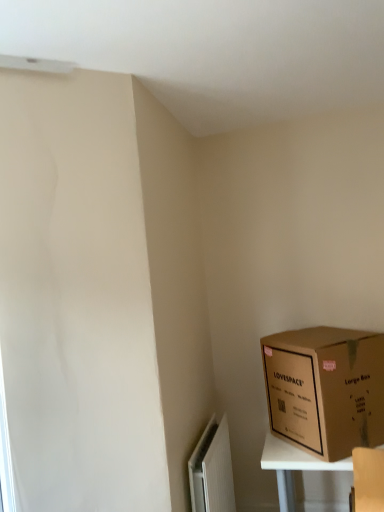
You are a GUI agent. You are given a task and a screenshot of the screen. Output one action in this format:
    pyautogui.click(x=<x>, y=<y>)
    Task: Click on the brown cardboard box at lower right
    
    Given the screenshot: What is the action you would take?
    pyautogui.click(x=325, y=389)

Measure the distance between point (x=350, y=345) and camera.

The distance of point (x=350, y=345) from camera is 6.77 feet.

What is the approximate height of brown cardboard box at lower right?

It is 20.89 inches.

In order to face brown cardboard box at lower right, should I rotate leftwards or rightwards?

Rotate your view right by about 17.382°.

Describe the element at coordinates (325, 389) in the screenshot. I see `brown cardboard box at lower right` at that location.

At what (x,y) coordinates should I click in order to perform the action: click on white matte radiator at lower left. Please return your answer as a coordinate pair (x, y). This screenshot has width=384, height=512. Looking at the image, I should click on (212, 470).

The width and height of the screenshot is (384, 512). What do you see at coordinates (212, 470) in the screenshot? I see `white matte radiator at lower left` at bounding box center [212, 470].

This screenshot has height=512, width=384. What are the coordinates of `brown cardboard box at lower right` in the screenshot? It's located at (325, 389).

Considering the relative positions of white matte radiator at lower left and brown cardboard box at lower right in the image provided, is white matte radiator at lower left to the right of brown cardboard box at lower right from the viewer's perspective?

In fact, white matte radiator at lower left is to the left of brown cardboard box at lower right.

Is white matte radiator at lower left positioned behind brown cardboard box at lower right?

No, it is in front of brown cardboard box at lower right.

Is point (217, 508) more distant than point (371, 386)?

Yes, point (217, 508) is farther from viewer.

From the picture: From the image's perspective, does white matte radiator at lower left appear higher than brown cardboard box at lower right?

Incorrect, from the image's perspective, white matte radiator at lower left is lower than brown cardboard box at lower right.

From a real-world perspective, relative to brown cardboard box at lower right, is white matte radiator at lower left vertically above or below?

white matte radiator at lower left is situated lower than brown cardboard box at lower right in the real world.

Looking at their sizes, would you say white matte radiator at lower left is wider or thinner than brown cardboard box at lower right?

In the image, white matte radiator at lower left appears to be more narrow than brown cardboard box at lower right.

Can you confirm if white matte radiator at lower left is taller than brown cardboard box at lower right?

Yes.

Who is smaller, white matte radiator at lower left or brown cardboard box at lower right?

Smaller between the two is white matte radiator at lower left.

Is brown cardboard box at lower right completely or partially inside white matte radiator at lower left?

No, brown cardboard box at lower right is not inside white matte radiator at lower left.

Are white matte radiator at lower left and brown cardboard box at lower right located far from each other?

white matte radiator at lower left is actually quite close to brown cardboard box at lower right.

Is white matte radiator at lower left positioned with its back to brown cardboard box at lower right?

white matte radiator at lower left is not turned away from brown cardboard box at lower right.

Can you tell me how much white matte radiator at lower left and brown cardboard box at lower right differ in facing direction?

There is a 50.8-degree angle between the facing directions of white matte radiator at lower left and brown cardboard box at lower right.

Where is `box located above the white matte radiator at lower left (from the image's perspective)`? The image size is (384, 512). box located above the white matte radiator at lower left (from the image's perspective) is located at coordinates pos(325,389).

Is brown cardboard box at lower right at the right side of white matte radiator at lower left?

Yes, brown cardboard box at lower right is to the right of white matte radiator at lower left.

Between brown cardboard box at lower right and white matte radiator at lower left, which one is positioned behind?

brown cardboard box at lower right is behind.

Does point (285, 371) lie in front of point (206, 444)?

No, (285, 371) is further to viewer.

From the image's perspective, which is below, brown cardboard box at lower right or white matte radiator at lower left?

white matte radiator at lower left is shown below in the image.

From a real-world perspective, is brown cardboard box at lower right below white matte radiator at lower left?

No, from a real-world perspective, brown cardboard box at lower right is not beneath white matte radiator at lower left.

Between brown cardboard box at lower right and white matte radiator at lower left, which one has larger width?

With larger width is brown cardboard box at lower right.

Considering the relative sizes of brown cardboard box at lower right and white matte radiator at lower left in the image provided, is brown cardboard box at lower right shorter than white matte radiator at lower left?

Yes.

Can you confirm if brown cardboard box at lower right is smaller than white matte radiator at lower left?

Incorrect, brown cardboard box at lower right is not smaller in size than white matte radiator at lower left.

Which is correct: brown cardboard box at lower right is inside white matte radiator at lower left, or outside of it?

brown cardboard box at lower right is spatially situated outside white matte radiator at lower left.

Is brown cardboard box at lower right not near white matte radiator at lower left?

No, brown cardboard box at lower right is not far away from white matte radiator at lower left.

Is brown cardboard box at lower right oriented towards white matte radiator at lower left?

No, brown cardboard box at lower right is not oriented towards white matte radiator at lower left.

Measure the distance between brown cardboard box at lower right and white matte radiator at lower left.

A distance of 23.74 inches exists between brown cardboard box at lower right and white matte radiator at lower left.

Locate an element on the screen. Image resolution: width=384 pixels, height=512 pixels. box above the white matte radiator at lower left (from the image's perspective) is located at coordinates (325, 389).

This screenshot has height=512, width=384. In order to click on radiator that appears on the left of brown cardboard box at lower right in this screenshot , I will do `click(212, 470)`.

Where is `box above the white matte radiator at lower left (from the image's perspective)`? This screenshot has height=512, width=384. box above the white matte radiator at lower left (from the image's perspective) is located at coordinates (325, 389).